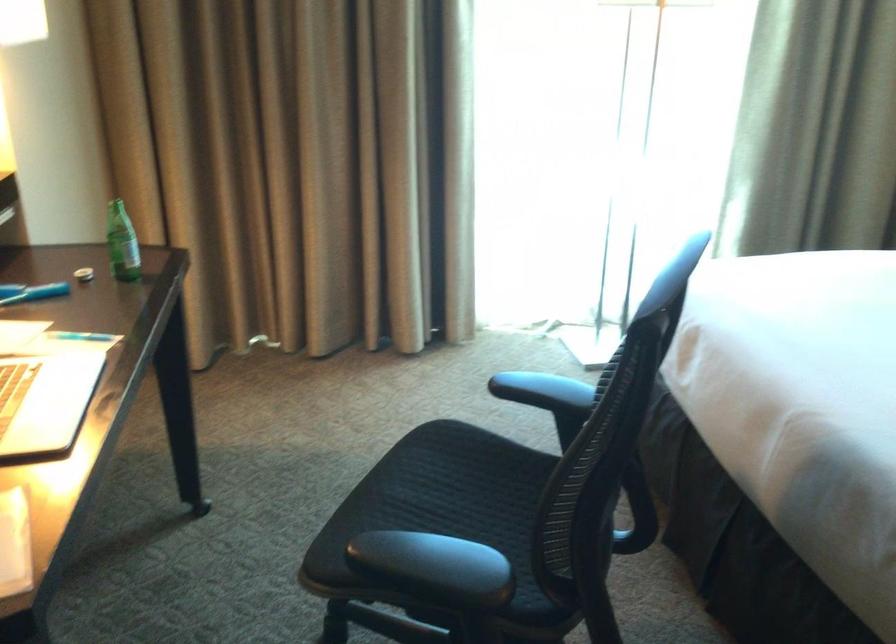
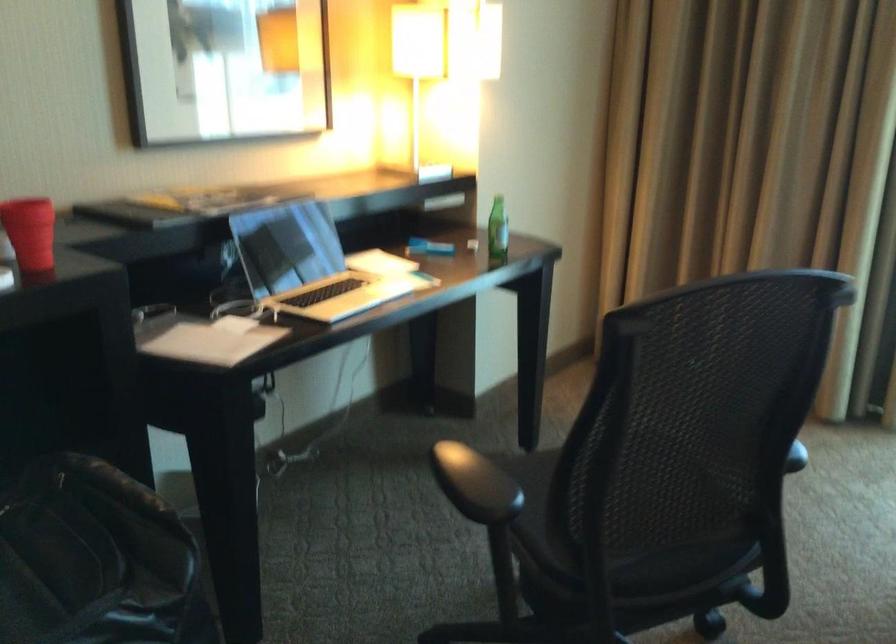
Locate, in the second image, the point that corresponds to point 131,249 in the first image.

(497, 229)